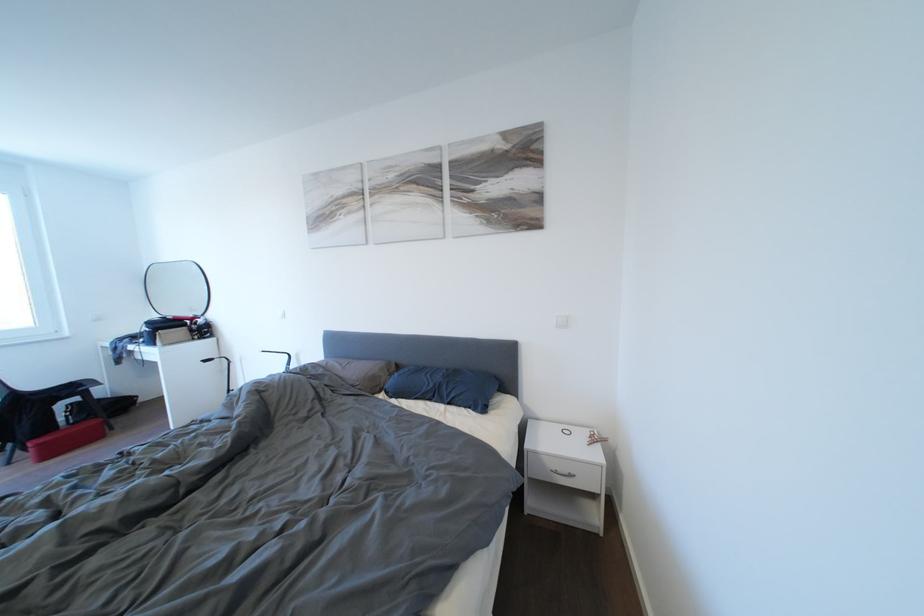
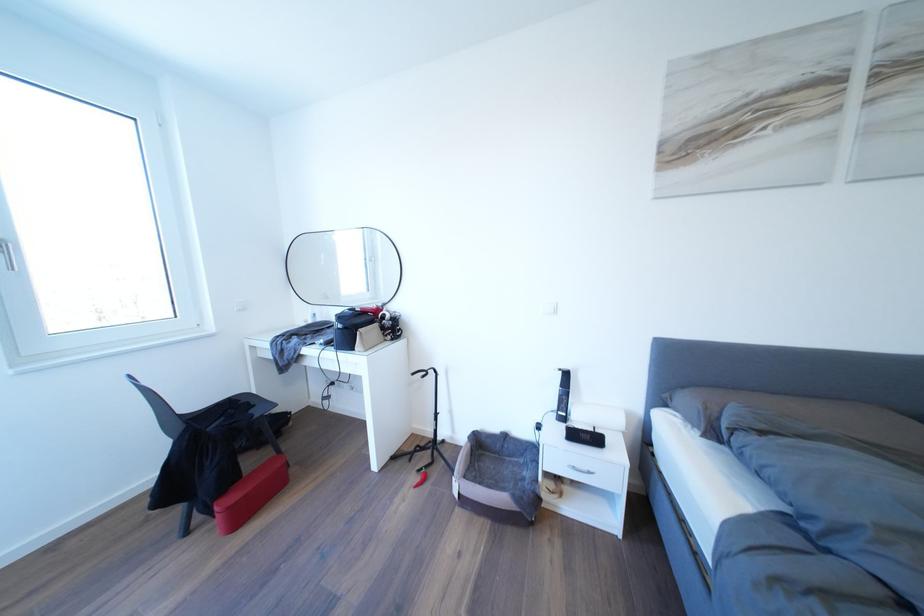
Where in the second image is the point corresponding to (33,455) from the first image?

(217, 519)